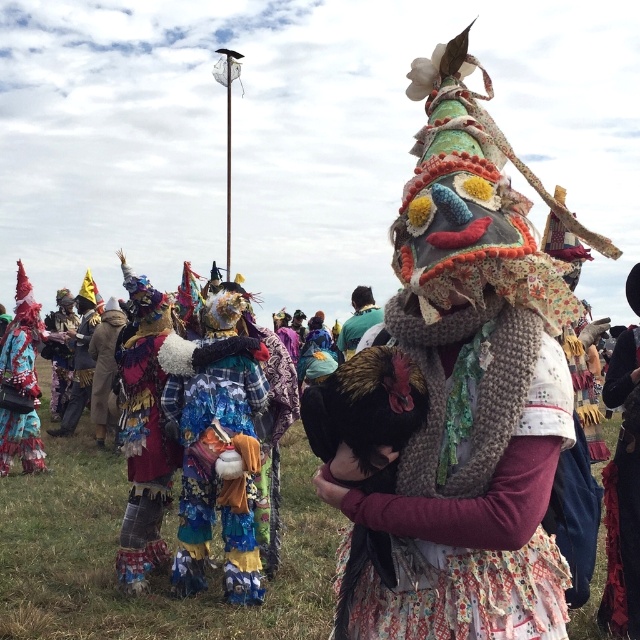
Question: Which object is the farthest from the knitted scarf at center?

Choices:
 (A) shiny red fabric at left
 (B) multicolored fabric at center

Answer: (A)

Question: Which point is farther to the camera?

Choices:
 (A) multicolored fabric at center
 (B) knitted scarf at center
 (C) shiny red fabric at left

Answer: (C)

Question: Is knitted scarf at center wider than multicolored fabric at center?

Choices:
 (A) no
 (B) yes

Answer: (A)

Question: Where is knitted scarf at center located in relation to multicolored fabric at center in the image?

Choices:
 (A) left
 (B) right

Answer: (B)

Question: Which object appears farthest from the camera in this image?

Choices:
 (A) shiny red fabric at left
 (B) knitted scarf at center

Answer: (A)

Question: Is knitted scarf at center to the left of shiny red fabric at left from the viewer's perspective?

Choices:
 (A) yes
 (B) no

Answer: (B)